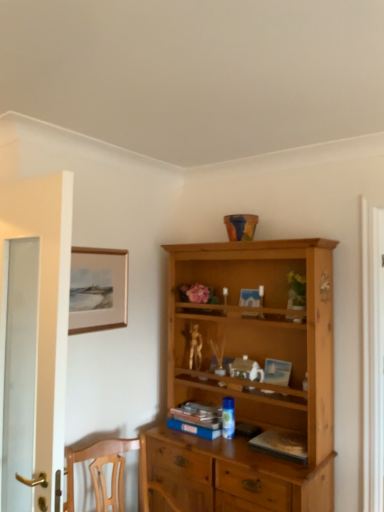
Question: From a real-world perspective, is hardcover book at center, the 1th book positioned from the front, positioned above or below gold metallic figurine at center?

Choices:
 (A) below
 (B) above

Answer: (A)

Question: From the image's perspective, is hardcover book at center, the second book from the back, above or below gold metallic figurine at center?

Choices:
 (A) above
 (B) below

Answer: (B)

Question: Estimate the real-world distances between objects in this image. Which object is closer to the matte gold picture frame at upper left?

Choices:
 (A) gold metallic figurine at center
 (B) white glass door at left
 (C) blue matte book at center, which is the 2th book from front to back
 (D) hardcover book at center, which is the 2th book from left to right

Answer: (A)

Question: Which of these objects is positioned farthest from the hardcover book at center, the 1th book positioned from the front?

Choices:
 (A) blue matte book at center, the first book positioned from the back
 (B) white glass door at left
 (C) matte gold picture frame at upper left
 (D) gold metallic figurine at center

Answer: (B)